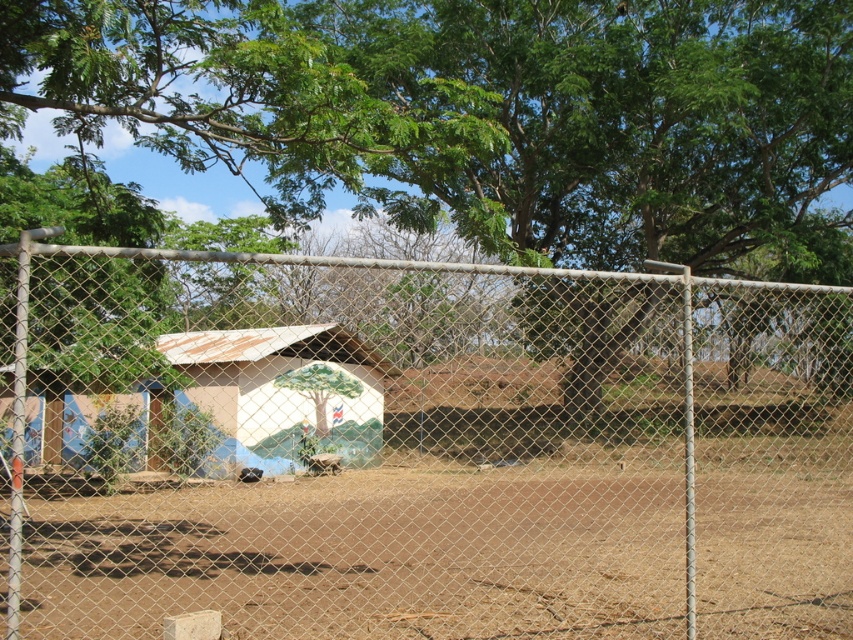
Question: Among these objects, which one is nearest to the camera?

Choices:
 (A) brown dirt field at center
 (B) metal mesh fence at center
 (C) green leafy tree at upper center

Answer: (B)

Question: Is green leafy tree at upper center to the right of brown dirt field at center from the viewer's perspective?

Choices:
 (A) no
 (B) yes

Answer: (A)

Question: Considering the real-world distances, which object is closest to the metal mesh fence at center?

Choices:
 (A) brown dirt field at center
 (B) green leafy tree at upper center
 (C) beige painted hut at center

Answer: (B)

Question: Is metal mesh fence at center bigger than beige painted hut at center?

Choices:
 (A) yes
 (B) no

Answer: (A)

Question: Among these points, which one is farthest from the camera?

Choices:
 (A) (192, 394)
 (B) (663, 593)

Answer: (A)

Question: Can you confirm if metal mesh fence at center is positioned to the left of brown dirt field at center?

Choices:
 (A) yes
 (B) no

Answer: (B)